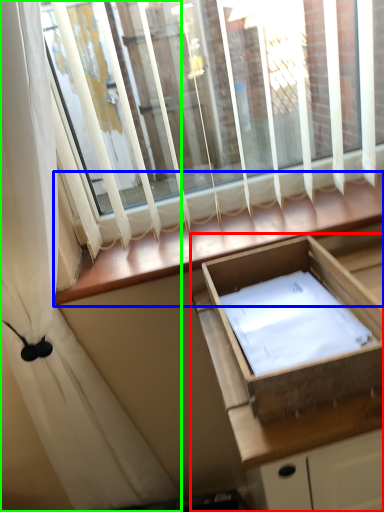
Question: Considering the real-world distances, which object is farthest from cabinetry (highlighted by a red box)? window sill (highlighted by a blue box) or curtain (highlighted by a green box)?

Choices:
 (A) window sill
 (B) curtain

Answer: (B)